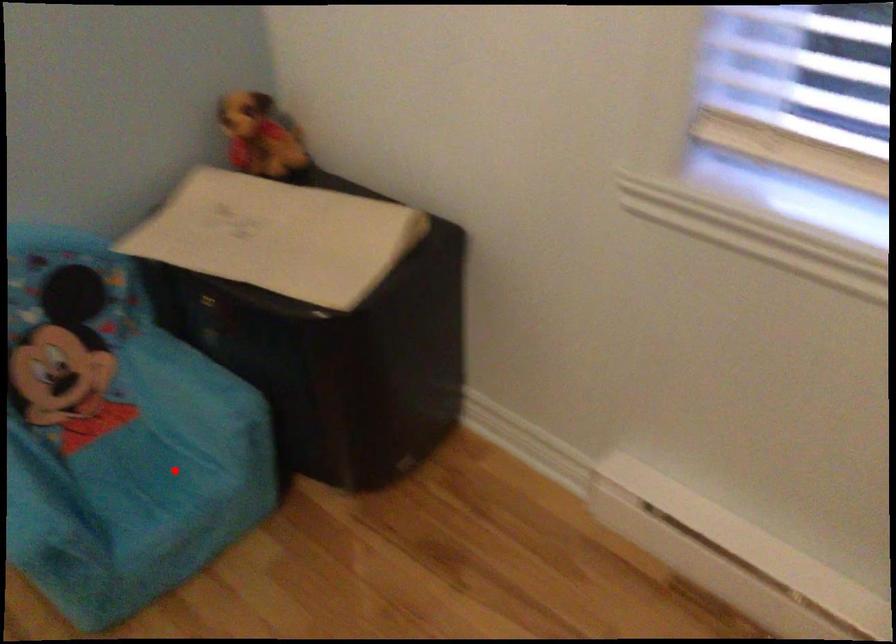
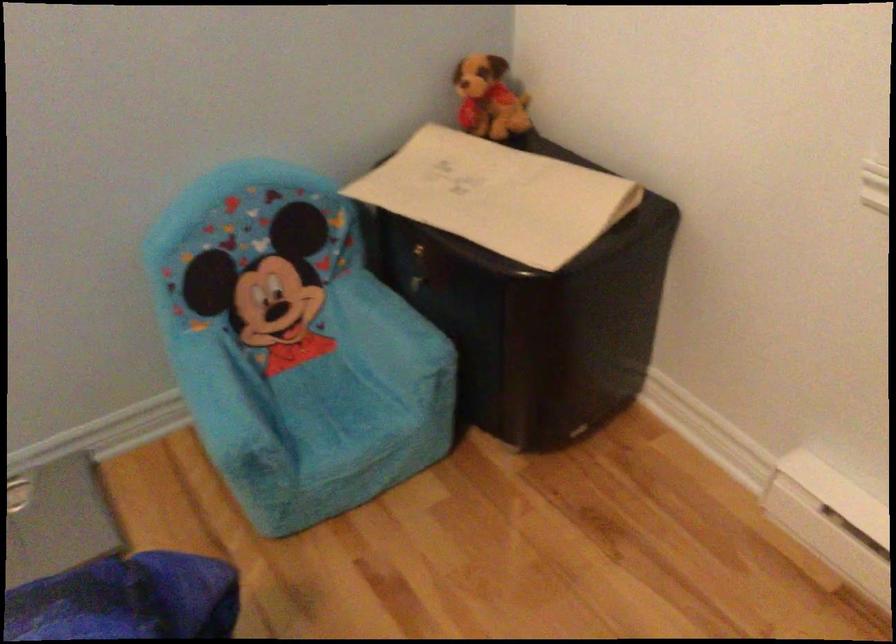
Locate, in the second image, the point that corresponds to the highlighted location in the first image.

(364, 402)